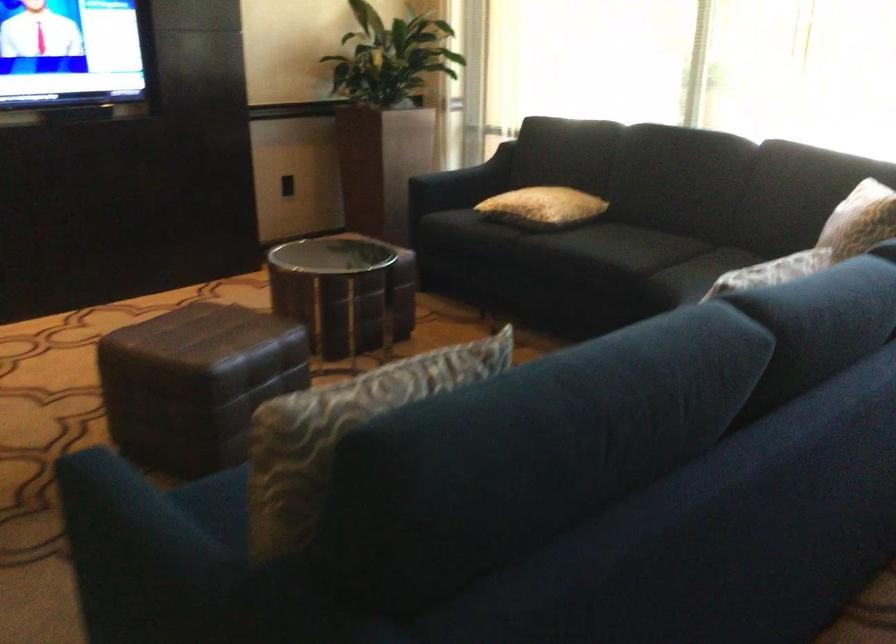
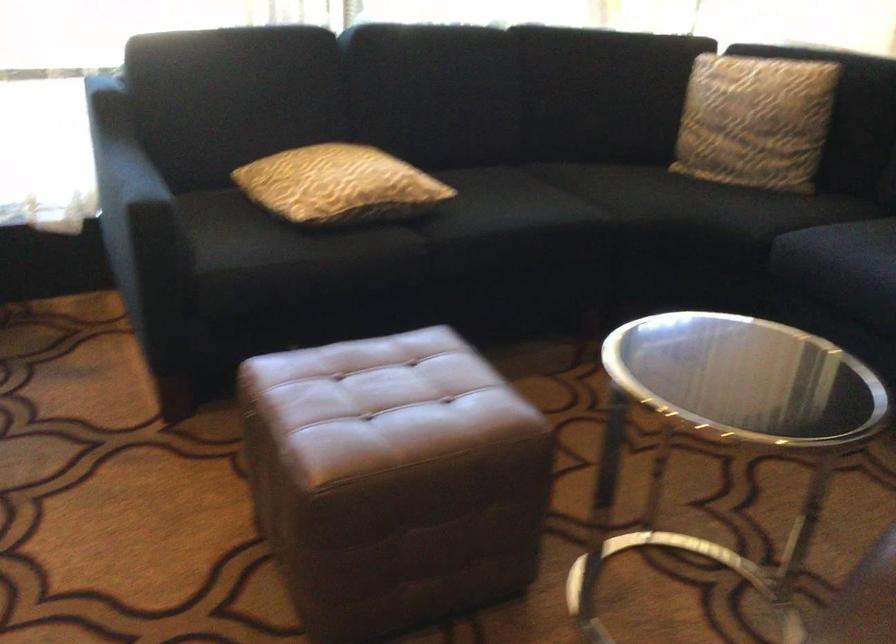
Locate, in the second image, the point that corresponds to point (460, 184) in the first image.

(170, 196)